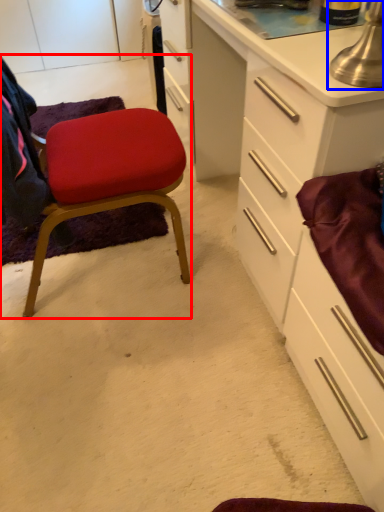
Question: Which point is further to the camera, chair (highlighted by a red box) or table lamp (highlighted by a blue box)?

Choices:
 (A) chair
 (B) table lamp

Answer: (A)